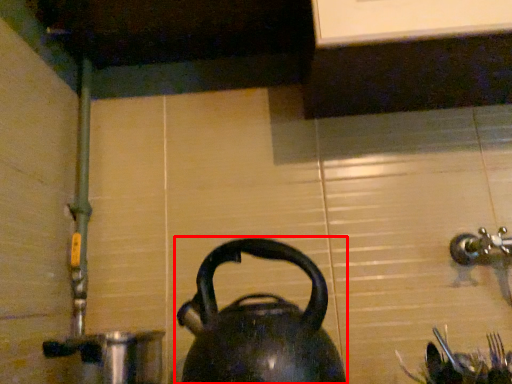
Question: Observing the image, what is the correct spatial positioning of kettle (annotated by the red box) in reference to coffeepot?

Choices:
 (A) right
 (B) left

Answer: (A)